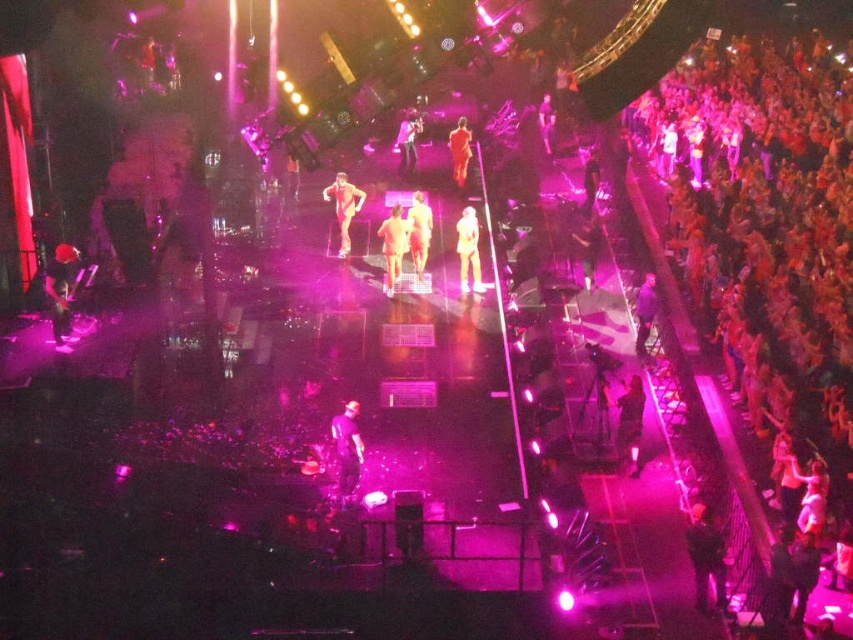
Question: Among these points, which one is nearest to the camera?

Choices:
 (A) (543, 113)
 (B) (68, 262)
 (C) (466, 218)

Answer: (B)

Question: Is smooth white dress at center above matte orange dress at center?

Choices:
 (A) no
 (B) yes

Answer: (A)

Question: Is smooth white dress at center thinner than shiny metallic shorts at center?

Choices:
 (A) no
 (B) yes

Answer: (B)

Question: Which object appears closest to the camera in this image?

Choices:
 (A) matte black pants at center
 (B) matte black dress at center
 (C) matte black camera at right
 (D) smooth skin at center

Answer: (A)

Question: Is shiny black pants at center below smooth skin at center?

Choices:
 (A) yes
 (B) no

Answer: (A)

Question: Which of the following is the closest to the observer?

Choices:
 (A) (643, 296)
 (B) (386, 272)

Answer: (A)